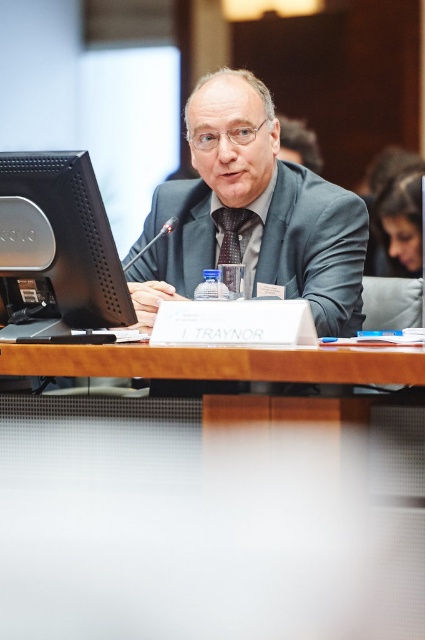
Can you confirm if matte gray suit at center is positioned to the left of black plastic monitor at left?

Incorrect, matte gray suit at center is not on the left side of black plastic monitor at left.

Who is more distant from viewer, (220, 104) or (45, 154)?

Positioned behind is point (220, 104).

Locate an element on the screen. This screenshot has width=425, height=640. matte gray suit at center is located at coordinates point(252,212).

Is wooden table at center taller than brown textured tie at center?

No.

Between point (299, 376) and point (234, 228), which one is positioned in front?

Positioned in front is point (299, 376).

The width and height of the screenshot is (425, 640). Identify the location of wooden table at center. (217, 362).

Consider the image. How much distance is there between black plastic monitor at left and brown textured tie at center?

black plastic monitor at left is 29.20 inches from brown textured tie at center.

Who is more distant from viewer, (31, 202) or (238, 237)?

The point (238, 237) is behind.

At what (x,y) coordinates should I click in order to perform the action: click on black plastic monitor at left. Please return your answer as a coordinate pair (x, y). Looking at the image, I should click on (57, 250).